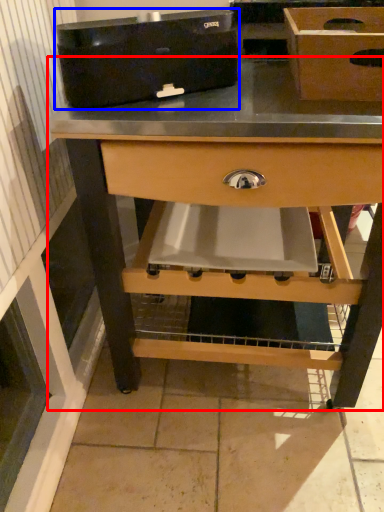
Question: Among these objects, which one is nearest to the camera, table (highlighted by a red box) or appliance (highlighted by a blue box)?

Choices:
 (A) table
 (B) appliance

Answer: (B)